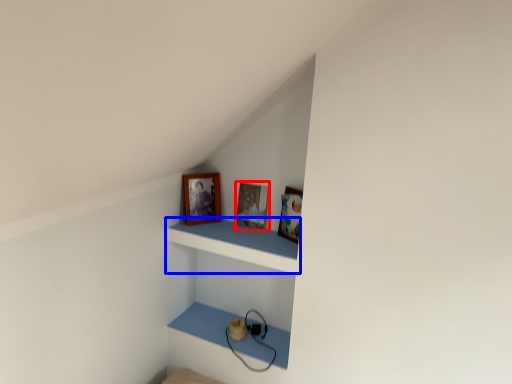
Question: Which object is further to the camera taking this photo, picture frame (highlighted by a red box) or shelf (highlighted by a blue box)?

Choices:
 (A) picture frame
 (B) shelf

Answer: (A)